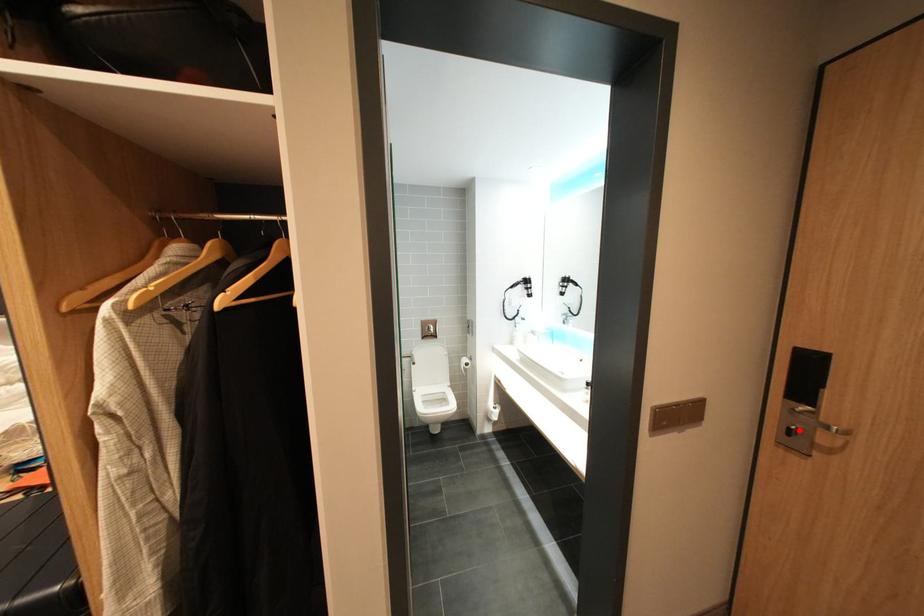
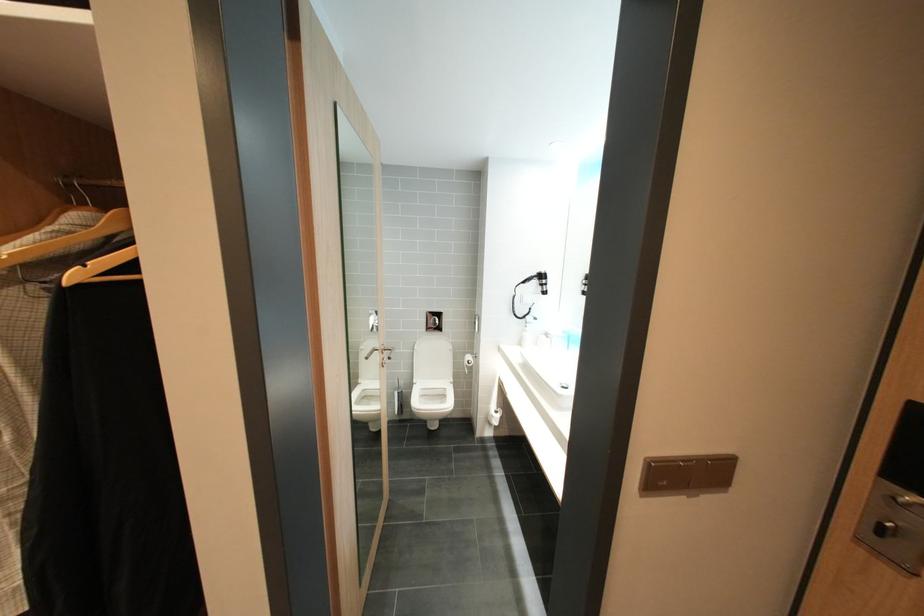
In the second image, find the point that corresponds to the highlighted location in the first image.

(891, 527)